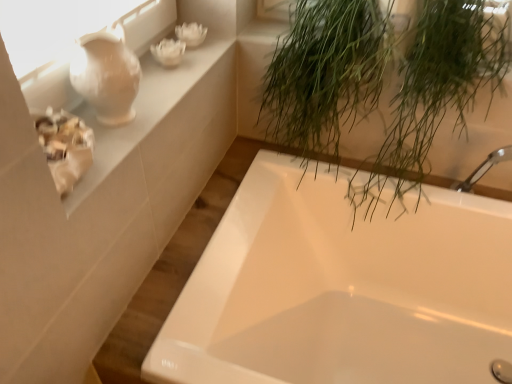
Question: Does white ceramic vase at upper left have a lesser height compared to white glossy bathtub at center?

Choices:
 (A) no
 (B) yes

Answer: (B)

Question: Can you confirm if white ceramic vase at upper left is bigger than white glossy bathtub at center?

Choices:
 (A) no
 (B) yes

Answer: (A)

Question: Is white ceramic vase at upper left in contact with white glossy bathtub at center?

Choices:
 (A) no
 (B) yes

Answer: (A)

Question: Does white ceramic vase at upper left turn towards white glossy bathtub at center?

Choices:
 (A) no
 (B) yes

Answer: (A)

Question: From the image's perspective, does white ceramic vase at upper left appear higher than white glossy bathtub at center?

Choices:
 (A) yes
 (B) no

Answer: (A)

Question: Is white glossy bathtub at center at the back of white ceramic vase at upper left?

Choices:
 (A) yes
 (B) no

Answer: (B)

Question: Considering the relative sizes of matte white vase at upper left and green leafy plant at upper right in the image provided, is matte white vase at upper left bigger than green leafy plant at upper right?

Choices:
 (A) yes
 (B) no

Answer: (B)

Question: Is matte white vase at upper left placed right next to green leafy plant at upper right?

Choices:
 (A) yes
 (B) no

Answer: (B)

Question: Can you confirm if matte white vase at upper left is thinner than green leafy plant at upper right?

Choices:
 (A) yes
 (B) no

Answer: (A)

Question: Is matte white vase at upper left shorter than green leafy plant at upper right?

Choices:
 (A) yes
 (B) no

Answer: (A)

Question: Considering the relative sizes of matte white vase at upper left and green leafy plant at upper right in the image provided, is matte white vase at upper left taller than green leafy plant at upper right?

Choices:
 (A) no
 (B) yes

Answer: (A)

Question: Is green leafy plant at upper right surrounded by matte white vase at upper left?

Choices:
 (A) yes
 (B) no

Answer: (B)

Question: From the image's perspective, is matte white vase at upper left below white glossy bathtub at center?

Choices:
 (A) no
 (B) yes

Answer: (A)